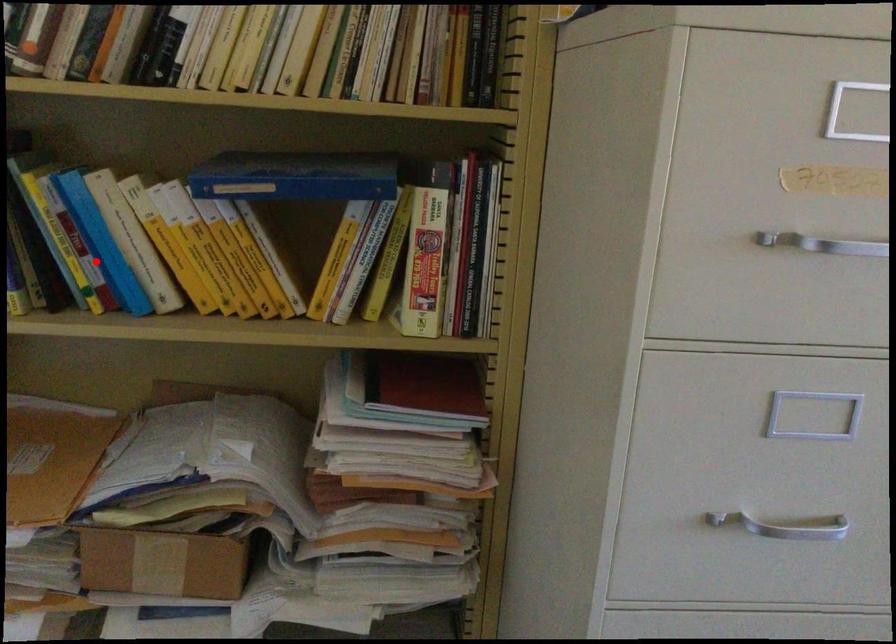
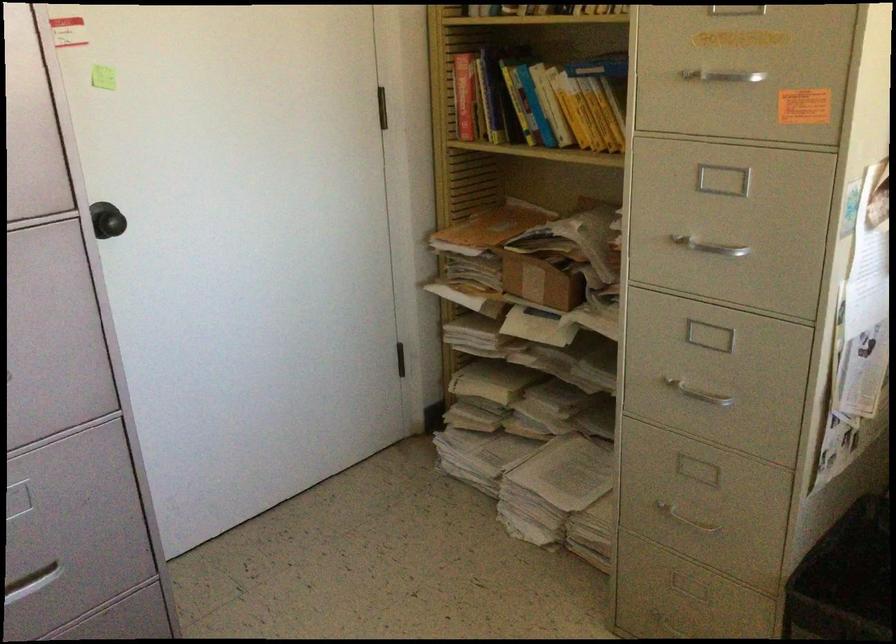
Question: A red point is marked in image1. In image2, is the corresponding 3D point closer to the camera or farther? Reply with the corresponding letter.

Choices:
 (A) The corresponding 3D point is closer.
 (B) The corresponding 3D point is farther.

Answer: (B)